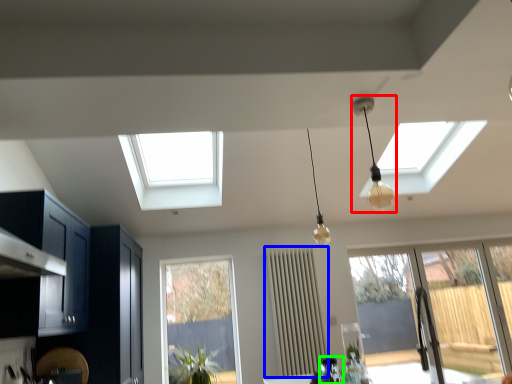
Question: Considering the real-world distances, which object is farthest from lamp (highlighted by a red box)? curtain (highlighted by a blue box) or appliance (highlighted by a green box)?

Choices:
 (A) curtain
 (B) appliance

Answer: (B)